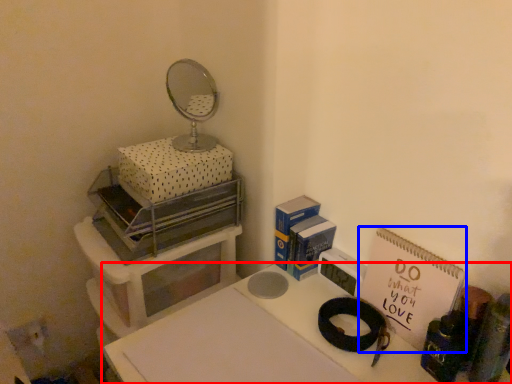
Question: Which of the following is the farthest to the observer, table (highlighted by a red box) or notebook (highlighted by a blue box)?

Choices:
 (A) table
 (B) notebook

Answer: (B)